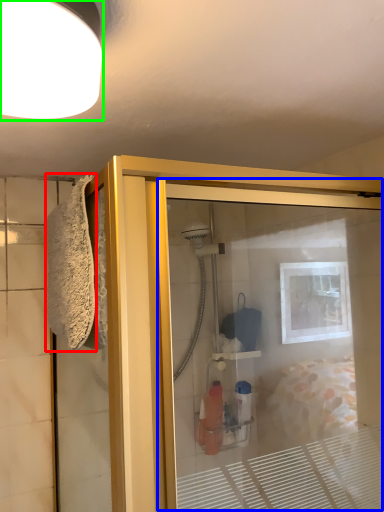
Question: Based on their relative distances, which object is nearer to bath towel (highlighted by a red box)? Choose from screen door (highlighted by a blue box) and light fixture (highlighted by a green box).

Choices:
 (A) screen door
 (B) light fixture

Answer: (B)